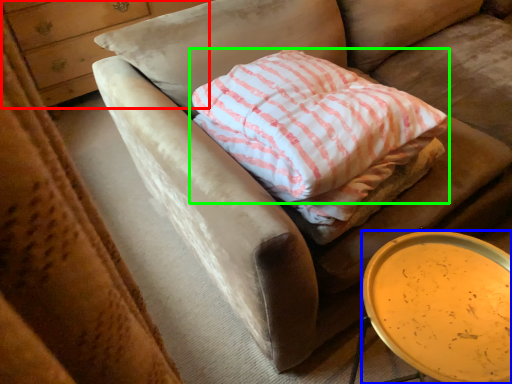
Question: Which object is the farthest from dresser (highlighted by a red box)? Choose among these: table (highlighted by a blue box) or pillow (highlighted by a green box).

Choices:
 (A) table
 (B) pillow

Answer: (A)